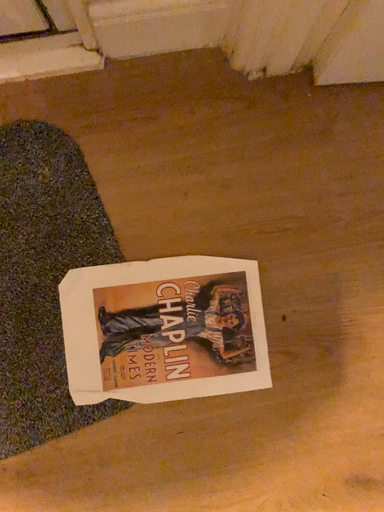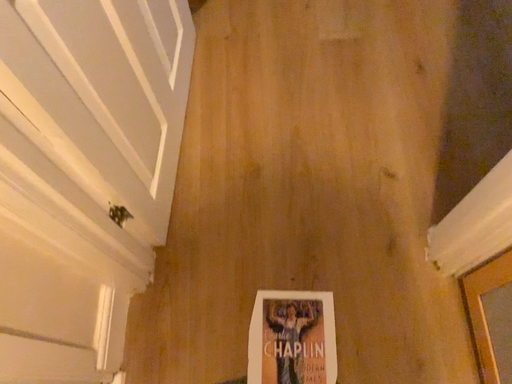
Question: Which way did the camera rotate in the video?

Choices:
 (A) rotated downward
 (B) rotated upward

Answer: (B)